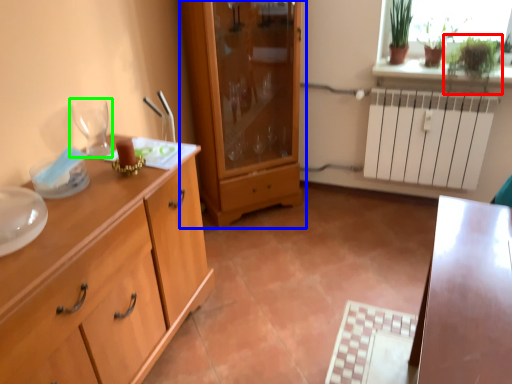
Question: Which object is the closest to the plant (highlighted by a red box)? Choose among these: cupboard (highlighted by a blue box) or wine glass (highlighted by a green box).

Choices:
 (A) cupboard
 (B) wine glass

Answer: (A)